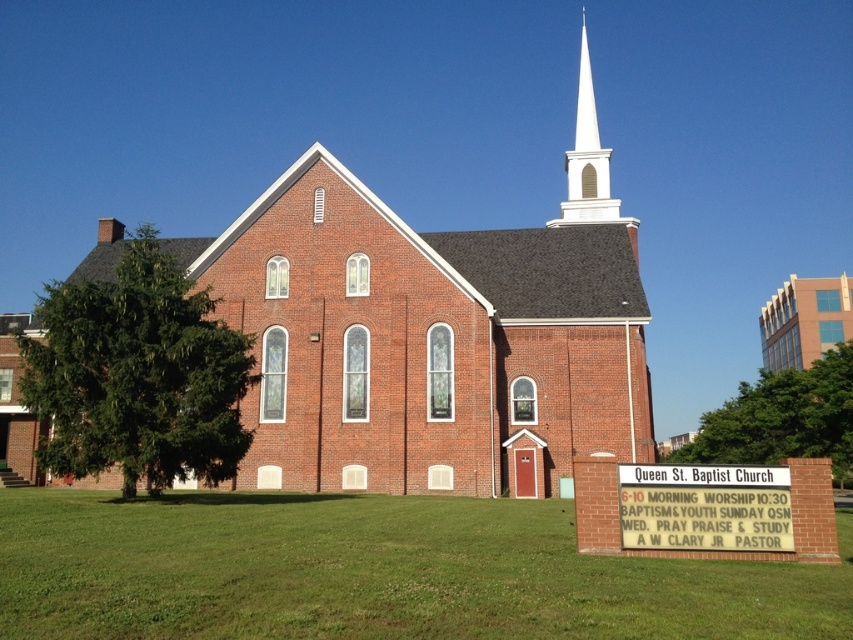
In the scene shown: You are standing in front of Queen St. Baptist Church and want to take a photo. There are two points marked in the scene. The first is point at point (x=227, y=269) and the second is point at point (x=833, y=289). Which point is closer to you?

Point at point (x=227, y=269) is closer to you than point at point (x=833, y=289).

You are a visitor approaching Queen St. Baptist Church and notice two white objects in front of you. Which one is narrower between the white plastic sign at center and the white smooth steeple at upper center?

The white plastic sign at center is thinner than the white smooth steeple at upper center, so the white plastic sign at center is narrower.

You are a visitor standing at the entrance of Queen St. Baptist Church. You notice the brick church steeple at center and the white plastic sign at center. Which object is larger in size?

The brick church steeple at center is bigger than the white plastic sign at center.